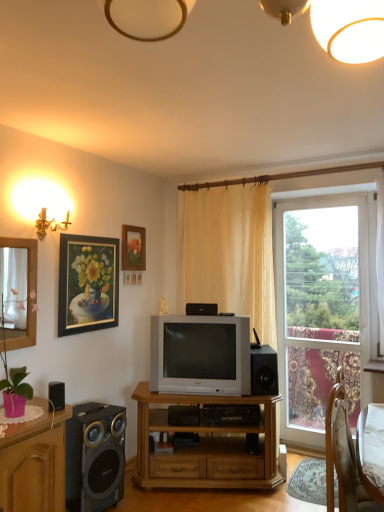
What do you see at coordinates (228, 253) in the screenshot?
I see `beige fabric curtain at center` at bounding box center [228, 253].

I want to click on black matte speaker at lower right, the third speaker viewed from the front, so click(264, 370).

Image resolution: width=384 pixels, height=512 pixels. What are the coordinates of `wooden tv stand at center` in the screenshot? It's located at (206, 445).

Describe the element at coordinates (206, 445) in the screenshot. I see `wooden tv stand at center` at that location.

Measure the distance between black plastic speaker at center, positioned as the fourth speaker in front-to-back order, and camera.

black plastic speaker at center, positioned as the fourth speaker in front-to-back order, and camera are 11.11 feet apart from each other.

Locate an element on the screen. gold-framed painting at upper left, the 1th picture frame when ordered from front to back is located at coordinates (88, 284).

Is wooden cabinet at lower left not near silver metallic television at center?

wooden cabinet at lower left is far away from silver metallic television at center.

From the image's perspective, does wooden cabinet at lower left appear higher than silver metallic television at center?

Actually, wooden cabinet at lower left appears below silver metallic television at center in the image.

Considering the positions of objects wooden cabinet at lower left and silver metallic television at center in the image provided, who is more to the left, wooden cabinet at lower left or silver metallic television at center?

From the viewer's perspective, wooden cabinet at lower left appears more on the left side.

Is wooden cabinet at lower left turned away from silver metallic television at center?

wooden cabinet at lower left is not turned away from silver metallic television at center.

From the image's perspective, between beige fabric curtain at center and matte wooden picture frame at upper center, which is the 1th picture frame in right-to-left order, who is located below?

beige fabric curtain at center is shown below in the image.

Is beige fabric curtain at center wider or thinner than matte wooden picture frame at upper center, which is the second picture frame from left to right?

beige fabric curtain at center is wider than matte wooden picture frame at upper center, which is the second picture frame from left to right.

Considering their positions, is beige fabric curtain at center located in front of or behind matte wooden picture frame at upper center, which is the 1th picture frame in right-to-left order?

In the image, beige fabric curtain at center appears in front of matte wooden picture frame at upper center, which is the 1th picture frame in right-to-left order.

Is black matte speaker at lower right, acting as the second speaker starting from the bottom, located within gold-framed painting at upper left, which is the second picture frame from right to left?

No, black matte speaker at lower right, acting as the second speaker starting from the bottom, is located outside of gold-framed painting at upper left, which is the second picture frame from right to left.

Considering the positions of objects gold-framed painting at upper left, the 1th picture frame when ordered from front to back, and black matte speaker at lower right, acting as the second speaker starting from the bottom, in the image provided, who is behind, gold-framed painting at upper left, the 1th picture frame when ordered from front to back, or black matte speaker at lower right, acting as the second speaker starting from the bottom,?

black matte speaker at lower right, acting as the second speaker starting from the bottom, is behind.

From a real-world perspective, is wooden cabinet at lower left positioned above or below black matte speaker at lower right, the third speaker viewed from the front?

Clearly, from a real-world perspective, wooden cabinet at lower left is below black matte speaker at lower right, the third speaker viewed from the front.

Is wooden cabinet at lower left shorter than black matte speaker at lower right, marked as the fourth speaker in a left-to-right arrangement?

No, wooden cabinet at lower left is not shorter than black matte speaker at lower right, marked as the fourth speaker in a left-to-right arrangement.

Is wooden cabinet at lower left wider than black matte speaker at lower right, which ranks as the 3th speaker in top-to-bottom order?

Yes, wooden cabinet at lower left is wider than black matte speaker at lower right, which ranks as the 3th speaker in top-to-bottom order.

Considering the positions of objects wooden cabinet at lower left and black matte speaker at lower right, which ranks as the 3th speaker in top-to-bottom order, in the image provided, who is more to the right, wooden cabinet at lower left or black matte speaker at lower right, which ranks as the 3th speaker in top-to-bottom order,?

From the viewer's perspective, black matte speaker at lower right, which ranks as the 3th speaker in top-to-bottom order, appears more on the right side.

Is gold-framed painting at upper left, the second picture frame when ordered from back to front, thinner than wooden tv stand at center?

Correct, the width of gold-framed painting at upper left, the second picture frame when ordered from back to front, is less than that of wooden tv stand at center.

Is gold-framed painting at upper left, the second picture frame when ordered from back to front, aimed at wooden tv stand at center?

No, gold-framed painting at upper left, the second picture frame when ordered from back to front, is not turned towards wooden tv stand at center.

At what (x,y) coordinates should I click in order to perform the action: click on the 2nd picture frame counting from the left side of the wooden tv stand at center. Please return your answer as a coordinate pair (x, y). The image size is (384, 512). Looking at the image, I should click on (x=88, y=284).

In the image, is gold-framed painting at upper left, which is the 1th picture frame in left-to-right order, positioned in front of or behind wooden tv stand at center?

gold-framed painting at upper left, which is the 1th picture frame in left-to-right order, is positioned closer to the viewer than wooden tv stand at center.

Between black matte speaker at lower left, which is counted as the 3th speaker, starting from the back, and black plastic speaker at center, the fourth speaker from the bottom, which one appears on the right side from the viewer's perspective?

black plastic speaker at center, the fourth speaker from the bottom.

Does black matte speaker at lower left, which is counted as the second speaker, starting from the front, have a lesser height compared to black plastic speaker at center, the third speaker when ordered from left to right?

No, black matte speaker at lower left, which is counted as the second speaker, starting from the front, is not shorter than black plastic speaker at center, the third speaker when ordered from left to right.

Could you tell me if black matte speaker at lower left, the 2th speaker from the left, is turned towards black plastic speaker at center, the third speaker when ordered from left to right?

No, black matte speaker at lower left, the 2th speaker from the left, does not turn towards black plastic speaker at center, the third speaker when ordered from left to right.

Is black matte speaker at lower left, which is the first speaker in bottom-to-top order, outside of black plastic speaker at center, positioned as the fourth speaker in front-to-back order?

Yes.

Does black matte speaker at lower right, marked as the first speaker in a right-to-left arrangement, come behind matte wooden picture frame at upper center, acting as the 2th picture frame starting from the front?

That is False.

Is matte wooden picture frame at upper center, which is the 1th picture frame in right-to-left order, at the back of black matte speaker at lower right, acting as the second speaker starting from the bottom?

No.

From a real-world perspective, is black matte speaker at lower right, acting as the second speaker starting from the bottom, on matte wooden picture frame at upper center, acting as the 2th picture frame starting from the front?

No, from a real-world perspective, black matte speaker at lower right, acting as the second speaker starting from the bottom, is not above matte wooden picture frame at upper center, acting as the 2th picture frame starting from the front.

This screenshot has width=384, height=512. In order to click on the 2nd speaker to the right of the matte wooden picture frame at upper center, which is the 1th picture frame in right-to-left order, counting from the anchor's position in this screenshot , I will do `click(264, 370)`.

Where is `cabinetry lying in front of the silver metallic television at center`? cabinetry lying in front of the silver metallic television at center is located at coordinates (34, 463).

You are a GUI agent. You are given a task and a screenshot of the screen. Output one action in this format:
    pyautogui.click(x=<x>, y=<y>)
    Task: Click on the picture frame behind the beige fabric curtain at center
    The width and height of the screenshot is (384, 512).
    Given the screenshot: What is the action you would take?
    pyautogui.click(x=133, y=248)

Looking at the image, which one is located further to black matte speaker at lower left, placed as the third speaker when sorted from right to left, wooden chair with white cushion at lower right or wooden tv stand at center?

Based on the image, wooden chair with white cushion at lower right appears to be further to black matte speaker at lower left, placed as the third speaker when sorted from right to left.

Based on their spatial positions, is wooden cabinet at lower left or silver metallic television at center closer to black matte speaker at lower left, which ranks as the 4th speaker in back-to-front order?

The object closer to black matte speaker at lower left, which ranks as the 4th speaker in back-to-front order, is wooden cabinet at lower left.

Which object lies further to the anchor point wooden cabinet at lower left, wooden tv stand at center or black matte speaker at lower right, which ranks as the 3th speaker in top-to-bottom order?

Based on the image, black matte speaker at lower right, which ranks as the 3th speaker in top-to-bottom order, appears to be further to wooden cabinet at lower left.

Considering their positions, is black matte speaker at lower left, the first speaker viewed from the front, positioned further to black matte speaker at lower left, the 2th speaker from the left, than matte wooden picture frame at upper center, acting as the 2th picture frame starting from the front?

matte wooden picture frame at upper center, acting as the 2th picture frame starting from the front.

Looking at the image, which one is located closer to black matte speaker at lower right, the third speaker viewed from the front, wooden tv stand at center or black plastic speaker at center, which is the 1th speaker in back-to-front order?

wooden tv stand at center.

Looking at the image, which one is located further to silver metallic television at center, wooden cabinet at lower left or gold-framed painting at upper left, the 1th picture frame when ordered from front to back?

wooden cabinet at lower left.

Based on their spatial positions, is black matte speaker at lower left, which is the first speaker in bottom-to-top order, or clear glass window at right closer to black matte speaker at lower left, the third speaker ordered from the bottom?

black matte speaker at lower left, which is the first speaker in bottom-to-top order, is positioned closer to the anchor black matte speaker at lower left, the third speaker ordered from the bottom.

Looking at the image, which one is located closer to black matte speaker at lower left, the first speaker viewed from the front, wooden chair with white cushion at lower right or gold-framed painting at upper left, which is the 1th picture frame in left-to-right order?

gold-framed painting at upper left, which is the 1th picture frame in left-to-right order, is closer to black matte speaker at lower left, the first speaker viewed from the front.

Identify the location of curtain between matte wooden picture frame at upper center, which is the second picture frame from left to right, and wooden tv stand at center from top to bottom. (228, 253).

Where is `picture frame located between black matte speaker at lower left, the third speaker ordered from the bottom, and matte wooden picture frame at upper center, which is the second picture frame from left to right, in the depth direction`? picture frame located between black matte speaker at lower left, the third speaker ordered from the bottom, and matte wooden picture frame at upper center, which is the second picture frame from left to right, in the depth direction is located at coordinates (88, 284).

This screenshot has height=512, width=384. What are the coordinates of `curtain between gold-framed painting at upper left, which is the 1th picture frame in left-to-right order, and wooden chair with white cushion at lower right from left to right` in the screenshot? It's located at (228, 253).

Image resolution: width=384 pixels, height=512 pixels. In order to click on curtain between black matte speaker at lower left, arranged as the 2th speaker when viewed from the top, and black matte speaker at lower right, acting as the second speaker starting from the bottom in this screenshot , I will do `click(228, 253)`.